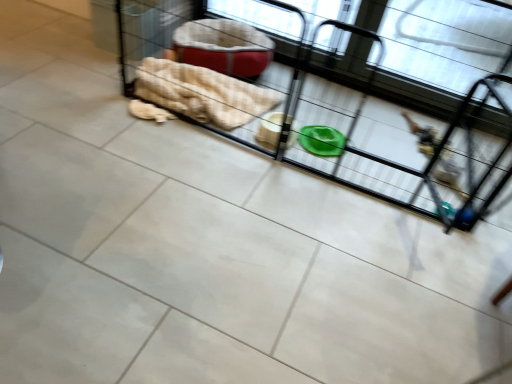
The height and width of the screenshot is (384, 512). In order to click on vacant space in front of green plastic bowl at center in this screenshot , I will do `click(248, 268)`.